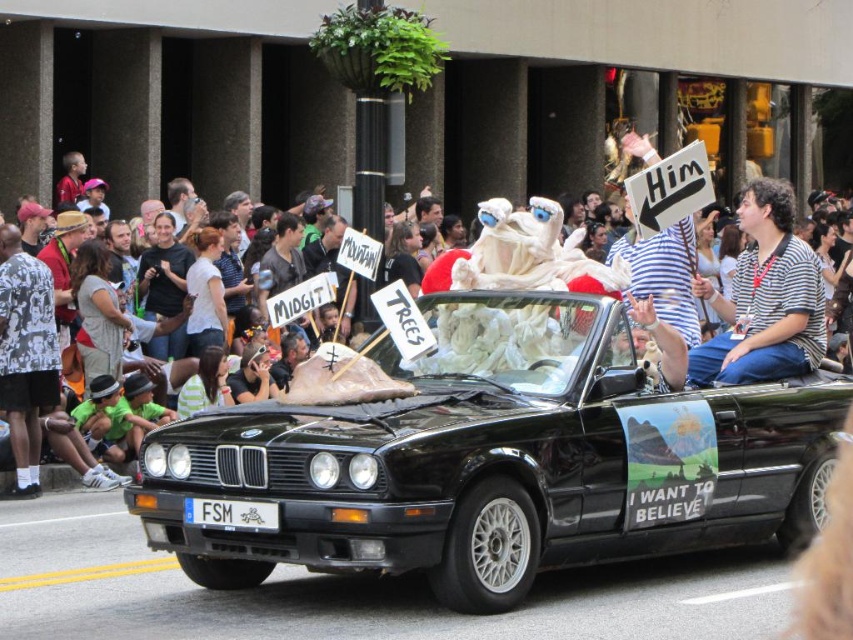
Question: Is black matte convertible at center behind striped shirt at center?

Choices:
 (A) no
 (B) yes

Answer: (A)

Question: Among these objects, which one is farthest from the camera?

Choices:
 (A) black matte convertible at center
 (B) white plastic fsm at center
 (C) white cotton crowd at center

Answer: (C)

Question: Estimate the real-world distances between objects in this image. Which object is farther from the striped shirt at center?

Choices:
 (A) white cotton crowd at center
 (B) black matte convertible at center
 (C) white plastic fsm at center

Answer: (C)

Question: Is black matte convertible at center wider than white plastic fsm at center?

Choices:
 (A) no
 (B) yes

Answer: (B)

Question: Which of the following is the farthest from the observer?

Choices:
 (A) (248, 502)
 (B) (305, 556)
 (C) (627, 211)

Answer: (C)

Question: In this image, where is striped shirt at center located relative to white cotton crowd at center?

Choices:
 (A) left
 (B) right

Answer: (B)